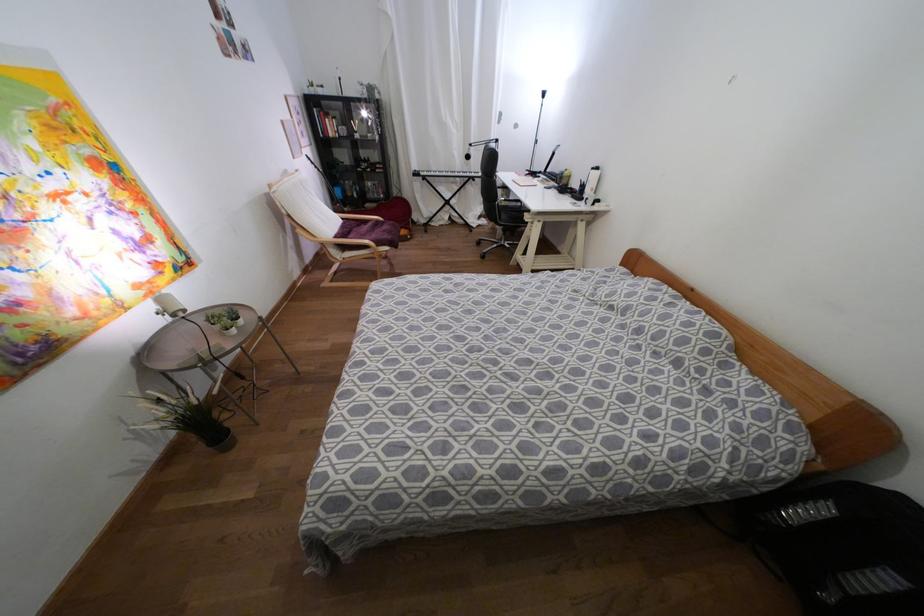
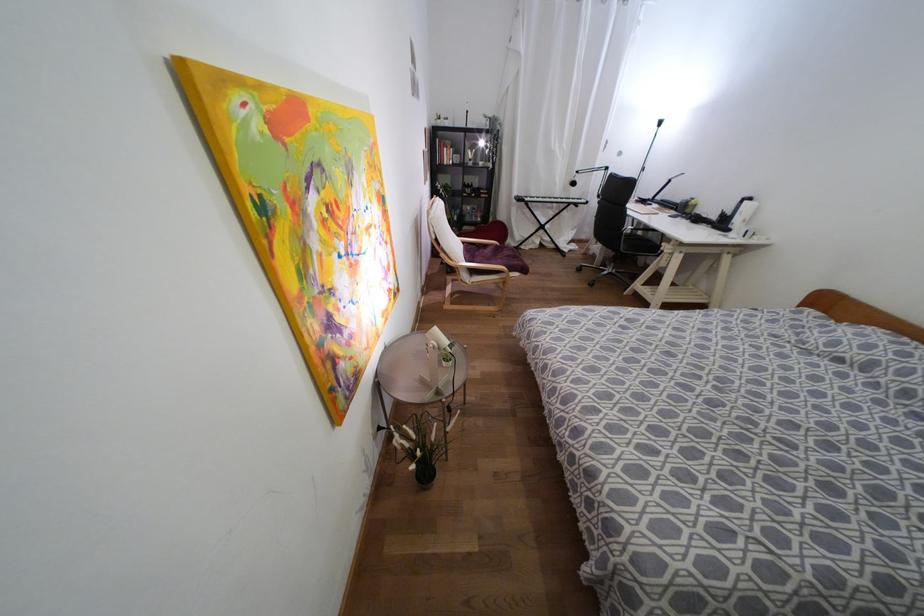
Find the pixel in the second image that matches pixel 363 113 in the first image.

(480, 143)